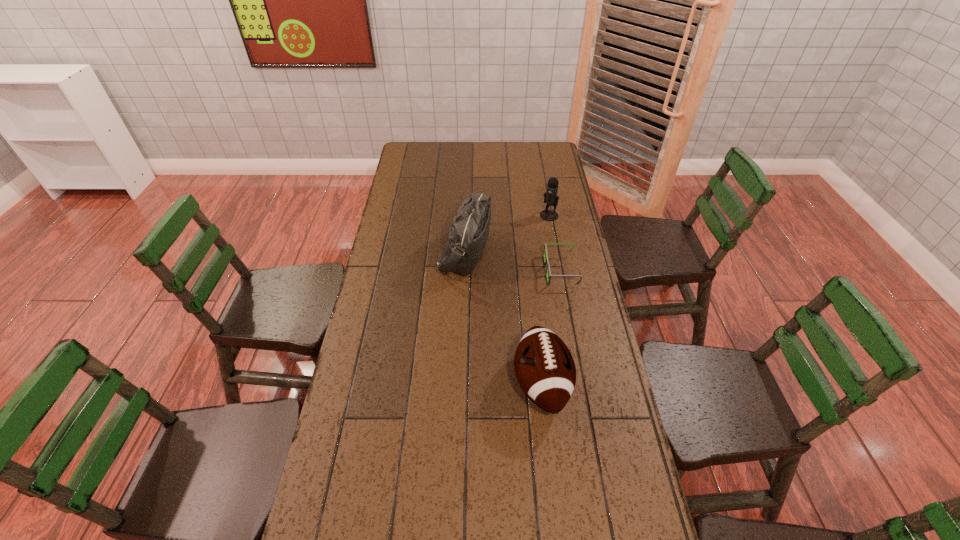
Find the location of a particular element. This screenshot has width=960, height=540. vacant space that is in between the spectacles and the shoulder bag is located at coordinates (513, 261).

Identify the location of vacant region between the shortest object and the farthest object. (555, 243).

Find the location of `free space between the spectacles and the football (American)`. free space between the spectacles and the football (American) is located at coordinates (551, 327).

You are a GUI agent. You are given a task and a screenshot of the screen. Output one action in this format:
    pyautogui.click(x=<x>, y=<y>)
    Task: Click on the vacant region between the microphone and the shoulder bag
    This screenshot has width=960, height=540.
    Given the screenshot: What is the action you would take?
    pyautogui.click(x=507, y=234)

Where is `vacant area that lies between the microphone and the football (American)`? vacant area that lies between the microphone and the football (American) is located at coordinates (545, 299).

This screenshot has height=540, width=960. I want to click on vacant space that's between the leftmost object and the football (American), so click(x=503, y=318).

This screenshot has height=540, width=960. Find the location of `unoccupied area between the farthest object and the leftmost object`. unoccupied area between the farthest object and the leftmost object is located at coordinates (507, 234).

Select which object appears as the closest to the shoulder bag. Please provide its 2D coordinates. Your answer should be formatted as a tuple, i.e. [(x, y)], where the tuple contains the x and y coordinates of a point satisfying the conditions above.

[(546, 261)]

This screenshot has width=960, height=540. I want to click on object that is the second nearest to the microphone, so click(468, 233).

Image resolution: width=960 pixels, height=540 pixels. Identify the location of free space in the image that satisfies the following two spatial constraints: 1. on the front side of the farthest object; 2. at the front padded panel of the shoulder bag. (556, 252).